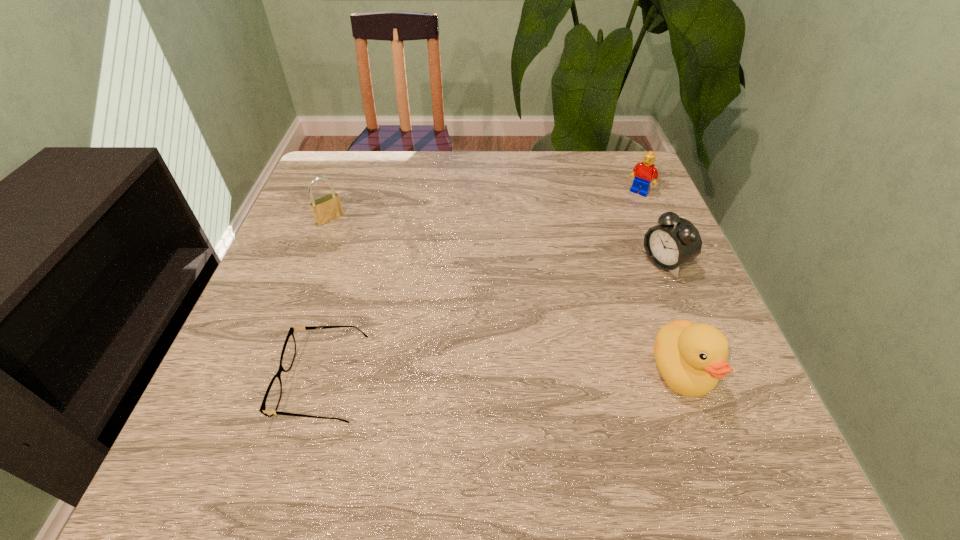
Where is `free space at the near left corner of the desktop`? free space at the near left corner of the desktop is located at coordinates (229, 386).

Where is `free space at the far right corner of the desktop`? The height and width of the screenshot is (540, 960). free space at the far right corner of the desktop is located at coordinates (606, 197).

Image resolution: width=960 pixels, height=540 pixels. What are the coordinates of `free space that is in between the farthest object and the duck` in the screenshot? It's located at (660, 282).

The image size is (960, 540). Identify the location of free area in between the spectacles and the padlock. (326, 301).

This screenshot has height=540, width=960. I want to click on unoccupied position between the duck and the padlock, so click(505, 295).

The width and height of the screenshot is (960, 540). Identify the location of unoccupied area between the alarm clock and the padlock. (497, 240).

I want to click on vacant point located between the fourth nearest object and the shortest object, so click(x=326, y=301).

Locate an element on the screen. The height and width of the screenshot is (540, 960). free space between the second farthest object and the shortest object is located at coordinates click(326, 301).

The image size is (960, 540). I want to click on empty space that is in between the second farthest object and the duck, so click(505, 295).

This screenshot has width=960, height=540. In order to click on empty space that is in between the duck and the third nearest object in this screenshot , I will do `click(673, 316)`.